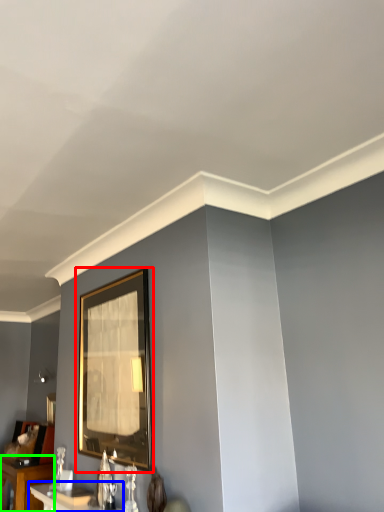
Question: Which is farther away from picture frame (highlighted by a red box)? table (highlighted by a blue box) or table (highlighted by a green box)?

Choices:
 (A) table
 (B) table

Answer: (B)